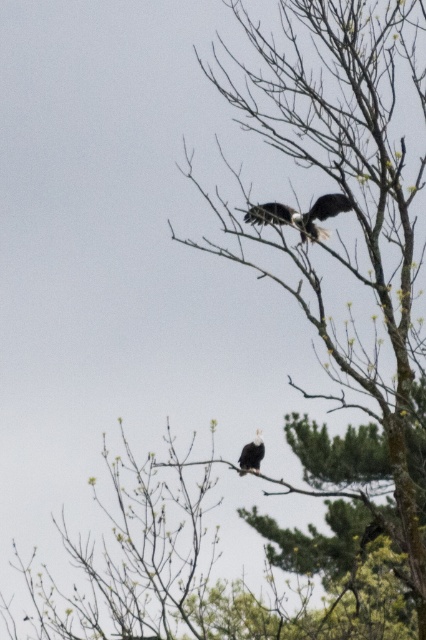
You are a photographer trying to focus on two points in the image of the bald eagles. The first point is at coordinates point (265, 218) and the second is at point (256, 440). Which point should you adjust your focus to if you want to capture the eagle closer to the camera?

Point (265, 218) is closer to the camera than point (256, 440), so you should focus on point (265, 218) to capture the eagle closer to the camera.

You are a birdwatcher trying to identify the location of a specific point in the image. The point is labeled as point (301, 214). According to the scene description, where exactly is this point located?

The point (301, 214) is located on the dark brown feathers at upper center.

You are a wildlife photographer trying to capture a photo of both the dark brown feathers at upper center and the white feathered eagle at upper right in the same frame. Given that your camera has a focal length of 300mm, which allows capturing subjects within a 10 feet range, will you be able to include both in the photo?

The dark brown feathers at upper center and the white feathered eagle at upper right are 5.21 feet apart from each other, which is within the 10 feet range of the camera. Therefore, both can be captured in the same frame.